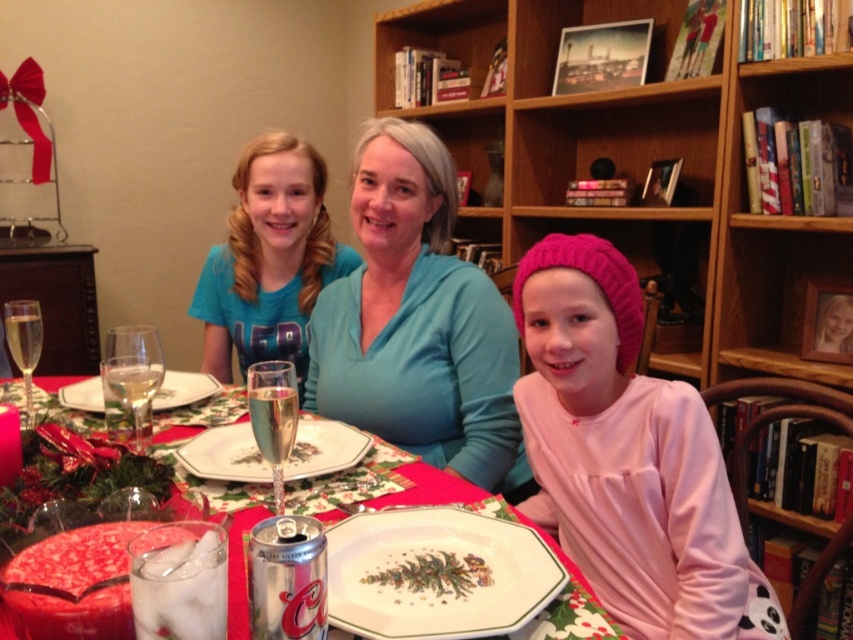
You are a guest at this holiday table and want to place your napkin on the larger item between the porcelain plate with christmas tree design at center and the metallic silver can at center. Which item should you choose?

The metallic silver can at center is larger than the porcelain plate with christmas tree design at center, so you should place your napkin on the metallic silver can at center.

You are a guest at this holiday dinner and want to reach for the clear glass wine glass at center without knocking over the porcelain plate at center. Which object should you move first?

The porcelain plate at center is positioned under the clear glass wine glass at center, so you should move the porcelain plate at center first to avoid knocking over the wine glass.